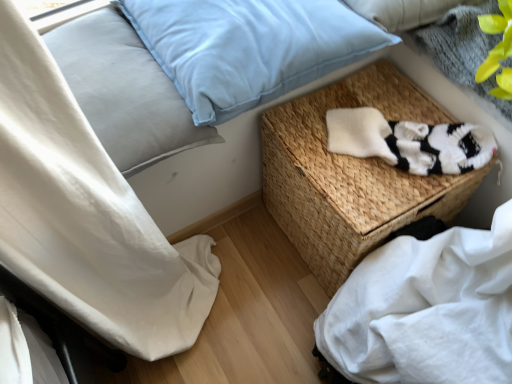
Question: Does white knitted socks at center-right have a larger size compared to white cotton sheet at lower right?

Choices:
 (A) no
 (B) yes

Answer: (A)

Question: Does white knitted socks at center-right have a lesser height compared to white cotton sheet at lower right?

Choices:
 (A) yes
 (B) no

Answer: (A)

Question: Does white knitted socks at center-right come in front of white cotton sheet at lower right?

Choices:
 (A) yes
 (B) no

Answer: (B)

Question: From a real-world perspective, is white knitted socks at center-right under white cotton sheet at lower right?

Choices:
 (A) yes
 (B) no

Answer: (B)

Question: Is white knitted socks at center-right not near white cotton sheet at lower right?

Choices:
 (A) no
 (B) yes

Answer: (A)

Question: Is white knitted socks at center-right further to the viewer compared to white cotton sheet at lower right?

Choices:
 (A) yes
 (B) no

Answer: (A)

Question: Can you confirm if light blue velvety pillow at upper center, the second pillow from the left, is bigger than light blue fabric pillow at upper left, which is the 2th pillow from right to left?

Choices:
 (A) no
 (B) yes

Answer: (B)

Question: Is light blue velvety pillow at upper center, the first pillow in the right-to-left sequence, at the left side of light blue fabric pillow at upper left, which is the first pillow in left-to-right order?

Choices:
 (A) yes
 (B) no

Answer: (B)

Question: Would you say light blue velvety pillow at upper center, the first pillow in the right-to-left sequence, is outside light blue fabric pillow at upper left, which is the first pillow in left-to-right order?

Choices:
 (A) no
 (B) yes

Answer: (B)

Question: Could you tell me if light blue velvety pillow at upper center, the first pillow in the right-to-left sequence, is turned towards light blue fabric pillow at upper left, which is the 2th pillow from right to left?

Choices:
 (A) no
 (B) yes

Answer: (A)

Question: Is light blue fabric pillow at upper left, which is the 2th pillow from right to left, surrounded by light blue velvety pillow at upper center, the second pillow from the left?

Choices:
 (A) no
 (B) yes

Answer: (A)

Question: Considering the relative sizes of light blue velvety pillow at upper center, the second pillow from the left, and light blue fabric pillow at upper left, which is the first pillow in left-to-right order, in the image provided, is light blue velvety pillow at upper center, the second pillow from the left, wider than light blue fabric pillow at upper left, which is the first pillow in left-to-right order,?

Choices:
 (A) yes
 (B) no

Answer: (A)

Question: Can you confirm if woven wicker basket at center is positioned to the left of light blue fabric pillow at upper left, which is the 2th pillow from right to left?

Choices:
 (A) yes
 (B) no

Answer: (B)